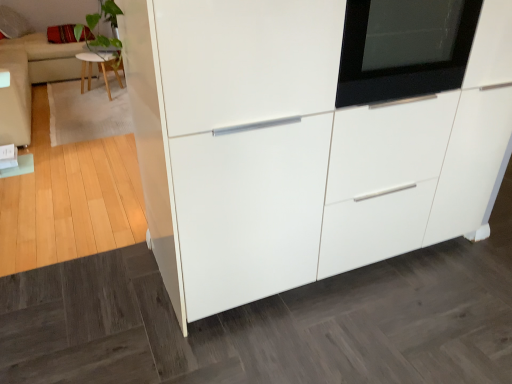
Question: Is black glass oven at upper right situated inside beige fabric couch at upper left, arranged as the first couch when viewed from the top, or outside?

Choices:
 (A) inside
 (B) outside

Answer: (B)

Question: In the image, is black glass oven at upper right on the left side or the right side of beige fabric couch at upper left, the second couch in the right-to-left sequence?

Choices:
 (A) left
 (B) right

Answer: (B)

Question: Based on their relative distances, which object is nearer to the light wood stool at upper left?

Choices:
 (A) black glass oven at upper right
 (B) velvet red pillow at upper left
 (C) white glossy cabinet at center
 (D) beige fabric couch at left, the 2th couch positioned from the back
 (E) beige fabric couch at upper left, arranged as the first couch when viewed from the top

Answer: (E)

Question: Estimate the real-world distances between objects in this image. Which object is farther from the light wood stool at upper left?

Choices:
 (A) beige fabric couch at upper left, the 2th couch when ordered from bottom to top
 (B) black glass oven at upper right
 (C) beige fabric couch at left, acting as the 2th couch starting from the top
 (D) velvet red pillow at upper left
 (E) white glossy cabinet at center

Answer: (B)